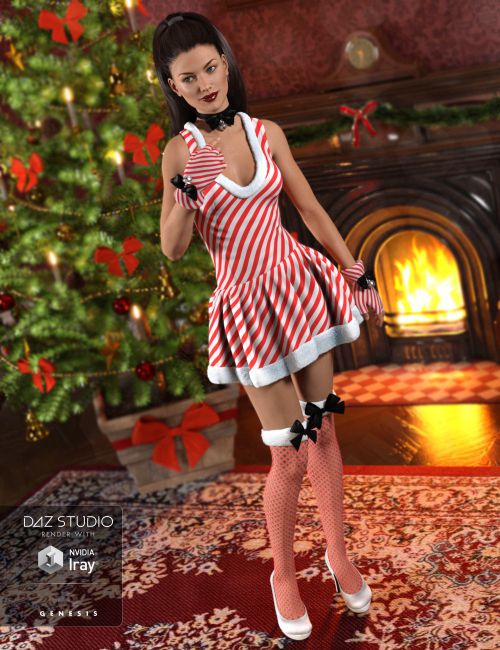
Locate an element on the screen. Image resolution: width=500 pixels, height=650 pixels. clock is located at coordinates (367, 56).